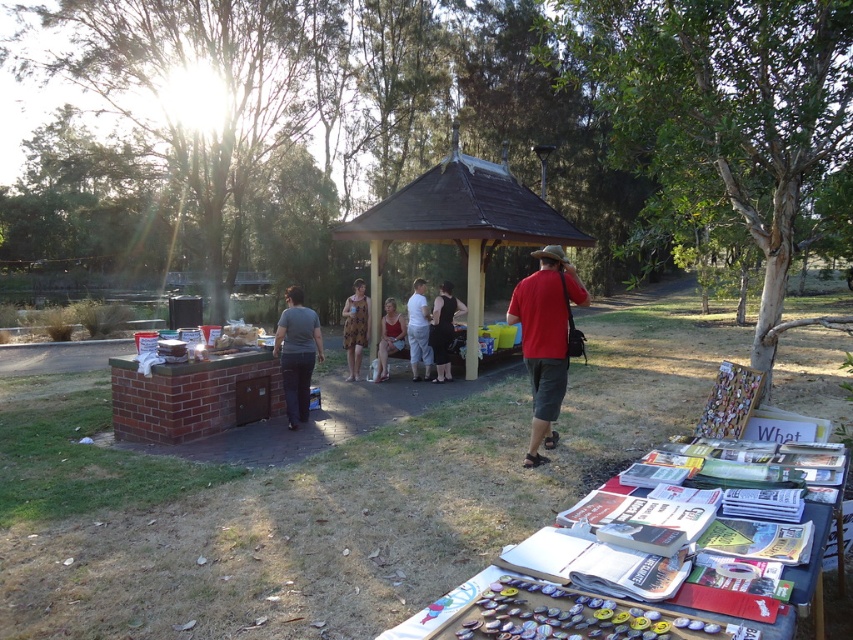
You are standing at the park and see two points in the image. Which point is closer to you, point (451,337) or point (421,349)?

Point (421,349) is closer to you because it is less further to the camera than point (451,337).

You are organizing a clothing display at the park and have two items to place on the table. The black smooth dress at center and the white cotton shirt at center. Which item requires more space on the table?

The black smooth dress at center is larger in size than the white cotton shirt at center, so it requires more space on the table.